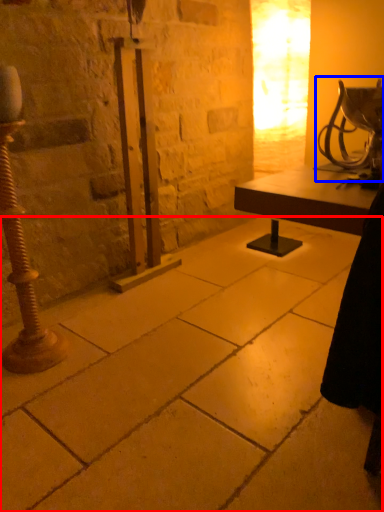
Question: Which point is closer to the camera, concrete (highlighted by a red box) or table lamp (highlighted by a blue box)?

Choices:
 (A) concrete
 (B) table lamp

Answer: (A)